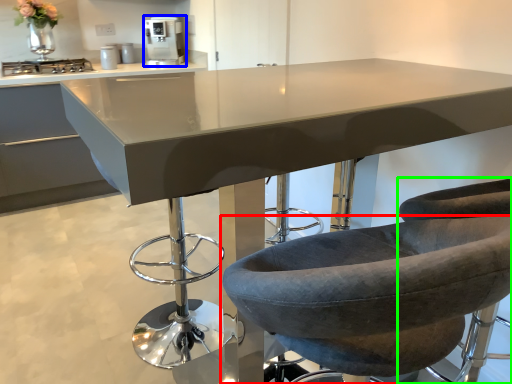
Question: Based on their relative distances, which object is farther from chair (highlighted by a red box)? Choose from home appliance (highlighted by a blue box) and chair (highlighted by a green box).

Choices:
 (A) home appliance
 (B) chair

Answer: (A)